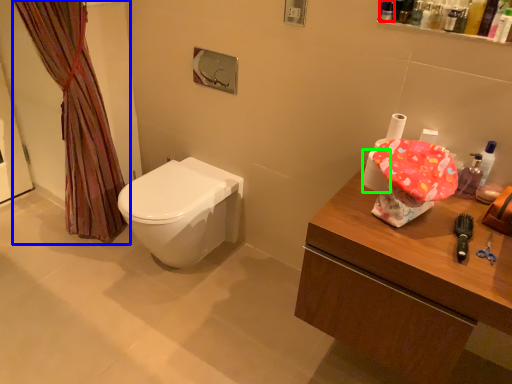
Question: Which object is the closest to the toiletry (highlighted by a red box)? Choose among these: curtain (highlighted by a blue box) or toilet paper (highlighted by a green box).

Choices:
 (A) curtain
 (B) toilet paper

Answer: (B)